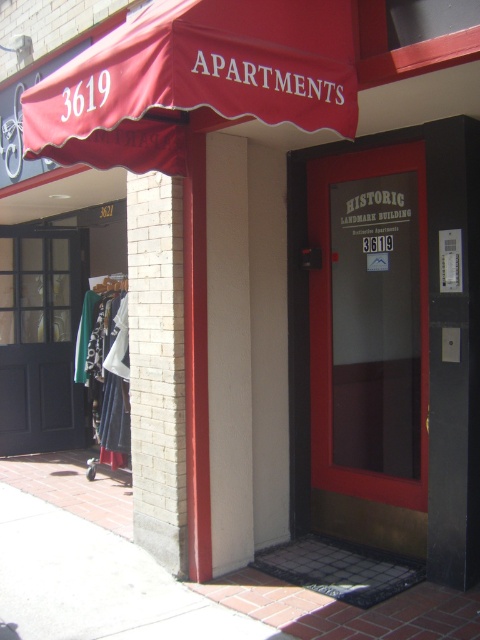
Question: Which point is farther from the camera taking this photo?

Choices:
 (A) (67, 448)
 (B) (363, 449)
 (C) (47, 109)

Answer: (A)

Question: Is matte glass door at center smaller than matte black door at left?

Choices:
 (A) no
 (B) yes

Answer: (B)

Question: Which object appears closest to the camera in this image?

Choices:
 (A) matte red awning at upper center
 (B) matte glass door at center
 (C) matte black door at left

Answer: (A)

Question: From the image, what is the correct spatial relationship of matte red awning at upper center in relation to matte black door at left?

Choices:
 (A) above
 (B) below

Answer: (A)

Question: Which of the following is the closest to the observer?

Choices:
 (A) matte red awning at upper center
 (B) matte glass door at center
 (C) matte black door at left

Answer: (A)

Question: Can you confirm if matte glass door at center is positioned below matte black door at left?

Choices:
 (A) no
 (B) yes

Answer: (A)